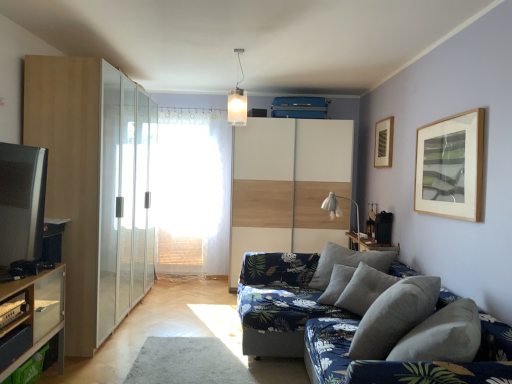
Question: Can you confirm if matte glass cabinet at left, positioned as the 2th dresser in back-to-front order, is bigger than wooden framed artwork at upper right?

Choices:
 (A) no
 (B) yes

Answer: (B)

Question: Does matte glass cabinet at left, positioned as the 2th dresser in back-to-front order, lie in front of wooden framed artwork at upper right?

Choices:
 (A) no
 (B) yes

Answer: (B)

Question: From the image's perspective, is matte glass cabinet at left, positioned as the 2th dresser in back-to-front order, beneath wooden framed artwork at upper right?

Choices:
 (A) yes
 (B) no

Answer: (A)

Question: Is wooden framed artwork at upper right completely or partially inside matte glass cabinet at left, the 1th dresser when ordered from front to back?

Choices:
 (A) no
 (B) yes

Answer: (A)

Question: Is matte glass cabinet at left, positioned as the 2th dresser in back-to-front order, at the left side of wooden framed artwork at upper right?

Choices:
 (A) yes
 (B) no

Answer: (A)

Question: Can you confirm if matte glass cabinet at left, the 1th dresser when ordered from front to back, is wider than wooden framed artwork at upper right?

Choices:
 (A) no
 (B) yes

Answer: (B)

Question: Are frosted glass window screen at center and gray fabric pillow at lower right making contact?

Choices:
 (A) yes
 (B) no

Answer: (B)

Question: From a real-world perspective, is frosted glass window screen at center over gray fabric pillow at lower right?

Choices:
 (A) no
 (B) yes

Answer: (B)

Question: Is gray fabric pillow at lower right located within frosted glass window screen at center?

Choices:
 (A) yes
 (B) no

Answer: (B)

Question: Is frosted glass window screen at center outside of gray fabric pillow at lower right?

Choices:
 (A) yes
 (B) no

Answer: (A)

Question: Is frosted glass window screen at center positioned with its back to gray fabric pillow at lower right?

Choices:
 (A) yes
 (B) no

Answer: (B)

Question: From a real-world perspective, is frosted glass window screen at center physically below gray fabric pillow at lower right?

Choices:
 (A) yes
 (B) no

Answer: (B)

Question: From a real-world perspective, is white glass pendant light at upper center on top of transparent glass screen door at left?

Choices:
 (A) yes
 (B) no

Answer: (A)